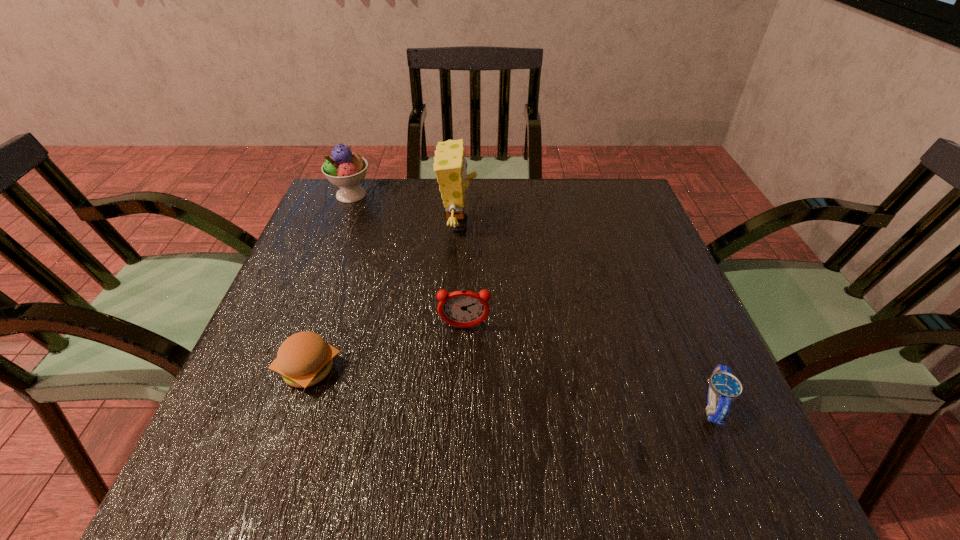
The width and height of the screenshot is (960, 540). I want to click on free region located 0.060m on the front of the hamburger, so (x=289, y=429).

You are a GUI agent. You are given a task and a screenshot of the screen. Output one action in this format:
    pyautogui.click(x=<x>, y=<y>)
    Task: Click on the vacant area situated on the left of the watch
    
    Given the screenshot: What is the action you would take?
    pyautogui.click(x=479, y=405)

Where is `sponge located in the far edge section of the desktop`? The image size is (960, 540). sponge located in the far edge section of the desktop is located at coordinates (450, 165).

Where is `icecream that is at the far edge`? Image resolution: width=960 pixels, height=540 pixels. icecream that is at the far edge is located at coordinates (344, 169).

You are a GUI agent. You are given a task and a screenshot of the screen. Output one action in this format:
    pyautogui.click(x=<x>, y=<y>)
    Task: Click on the icecream present at the left edge
    
    Given the screenshot: What is the action you would take?
    pyautogui.click(x=344, y=169)

You are a GUI agent. You are given a task and a screenshot of the screen. Output one action in this format:
    pyautogui.click(x=<x>, y=<y>)
    Task: Click on the hamburger present at the left edge
    
    Given the screenshot: What is the action you would take?
    point(304,359)

The width and height of the screenshot is (960, 540). Identify the location of object present at the right edge. (724, 388).

Locate an element on the screen. object that is at the far left corner is located at coordinates click(x=344, y=169).

In order to click on free space at the far edge in this screenshot , I will do `click(505, 195)`.

Locate an element on the screen. vacant point at the near edge is located at coordinates (468, 463).